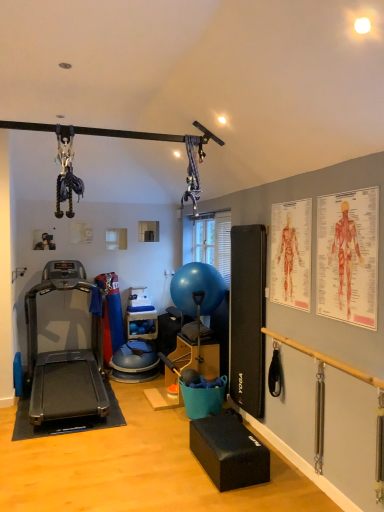
Question: Does point (360, 203) appear closer or farther from the camera than point (286, 216)?

Choices:
 (A) closer
 (B) farther

Answer: (A)

Question: In terms of width, does red paper human anatomy chart at upper right look wider or thinner when compared to anatomical chart at upper right, the second person positioned from the left?

Choices:
 (A) thin
 (B) wide

Answer: (A)

Question: Based on their relative distances, which object is farther from the anatomical chart at upper right, which is the first person from right to left?

Choices:
 (A) blue rubber shelf at center
 (B) wooden bar at right
 (C) blue rubber ball at center
 (D) metallic silver photo frame at upper left, acting as the second person starting from the right
 (E) black rubber treadmill at left

Answer: (D)

Question: Which is nearer to the blue rubber ball at center?

Choices:
 (A) black rubber treadmill at left
 (B) red paper human anatomy chart at upper right
 (C) blue rubber shelf at center
 (D) wooden bar at right
 (E) anatomical chart at upper right, arranged as the first person when viewed from the front

Answer: (C)